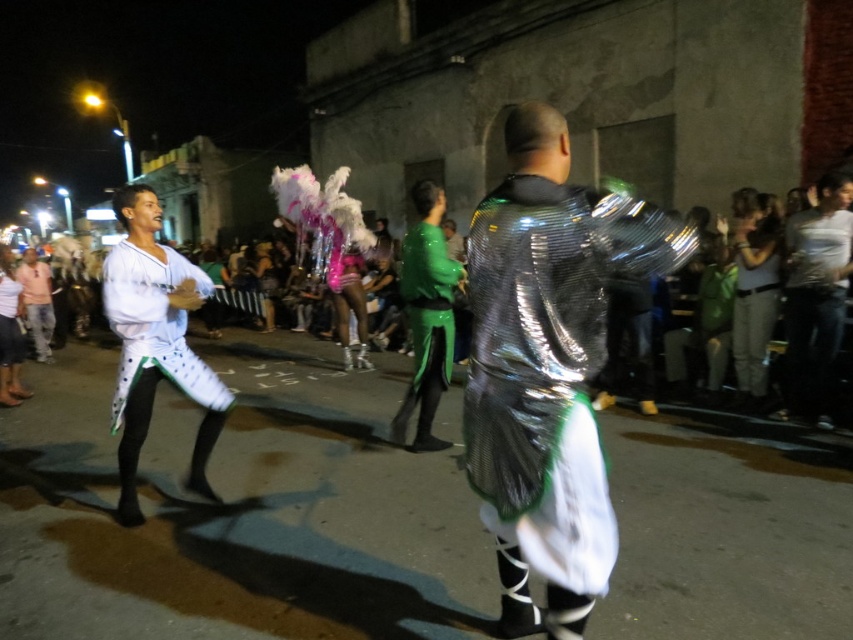
How distant is white matte shirt at right from green glossy suit at center?

A distance of 2.19 meters exists between white matte shirt at right and green glossy suit at center.

This screenshot has width=853, height=640. What do you see at coordinates (815, 296) in the screenshot?
I see `white matte shirt at right` at bounding box center [815, 296].

Does point (834, 272) lie in front of point (428, 300)?

No.

Image resolution: width=853 pixels, height=640 pixels. What are the coordinates of `white matte shirt at right` in the screenshot? It's located at (815, 296).

Is matte green pants at lower center above white matte pants at center?

Indeed, matte green pants at lower center is positioned over white matte pants at center.

Where is `matte green pants at lower center`? Image resolution: width=853 pixels, height=640 pixels. matte green pants at lower center is located at coordinates [x=747, y=353].

Locate an element on the screen. The width and height of the screenshot is (853, 640). matte green pants at lower center is located at coordinates (747, 353).

Which of these two, white matte pants at center or green glossy suit at center, stands taller?

Standing taller between the two is green glossy suit at center.

Does white matte pants at center have a greater width compared to green glossy suit at center?

Indeed, white matte pants at center has a greater width compared to green glossy suit at center.

At what (x,y) coordinates should I click in order to perform the action: click on white matte pants at center. Please return your answer as a coordinate pair (x, y). Looking at the image, I should click on (154, 324).

Identify the location of white matte pants at center. (154, 324).